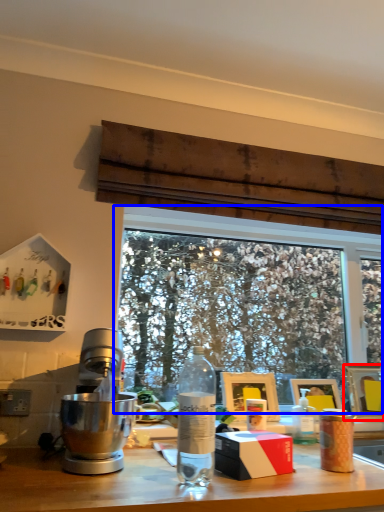
Question: Which of the following is the farthest to the observer, picture frame (highlighted by a red box) or window (highlighted by a blue box)?

Choices:
 (A) picture frame
 (B) window

Answer: (A)